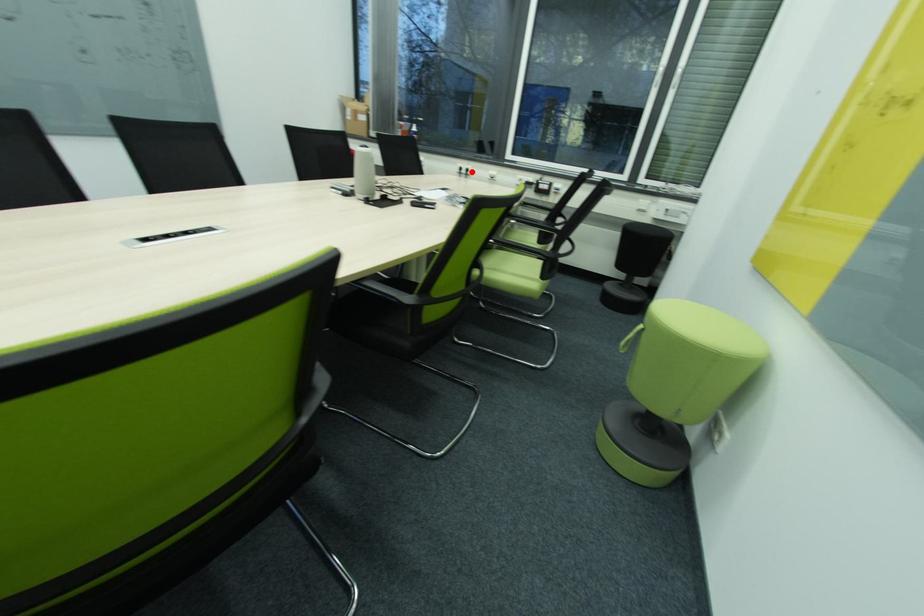
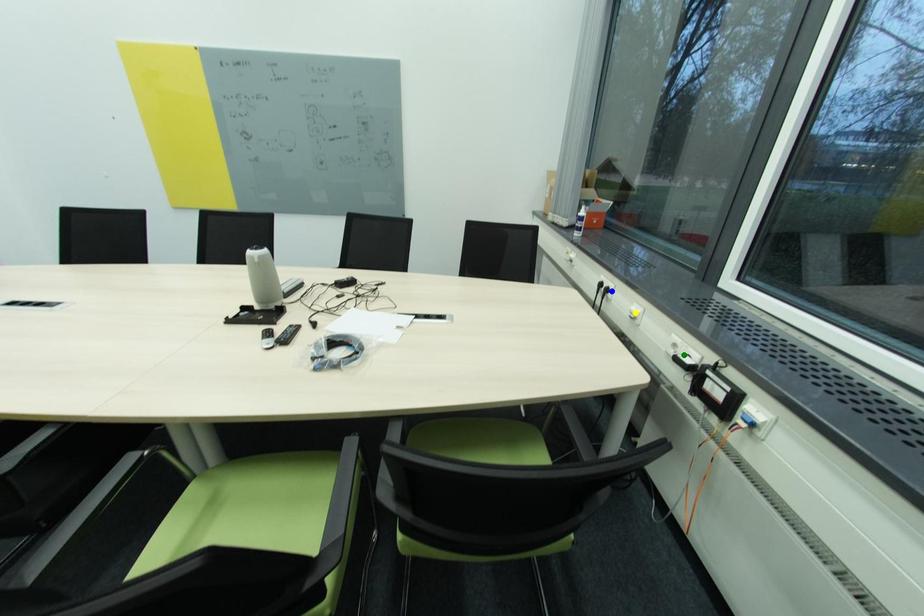
Question: I am providing you with two images of the same scene from different viewpoints. A red point is marked on the first image. You are given multiple points on the second image. In image 2, which mark is for the same physical point as the one in image 1?

Choices:
 (A) yellow point
 (B) green point
 (C) blue point

Answer: (C)